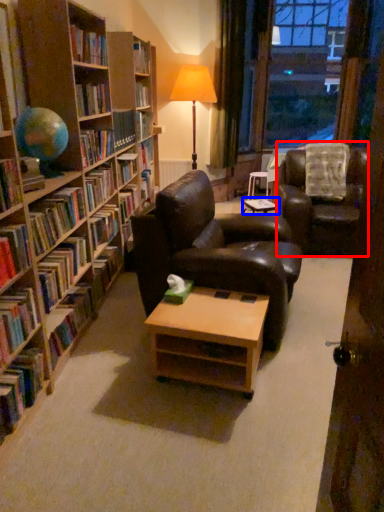
Question: Among these objects, which one is nearest to the camera, chair (highlighted by a red box) or table (highlighted by a blue box)?

Choices:
 (A) chair
 (B) table

Answer: (A)